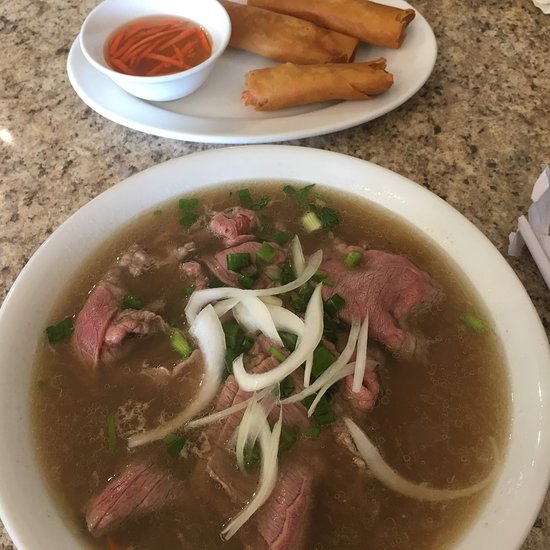
You are a GUI agent. You are given a task and a screenshot of the screen. Output one action in this format:
    pyautogui.click(x=<x>, y=<y>)
    Task: Click on the white circular plate
    The image size is (550, 550).
    Given the screenshot: What is the action you would take?
    pyautogui.click(x=226, y=126)